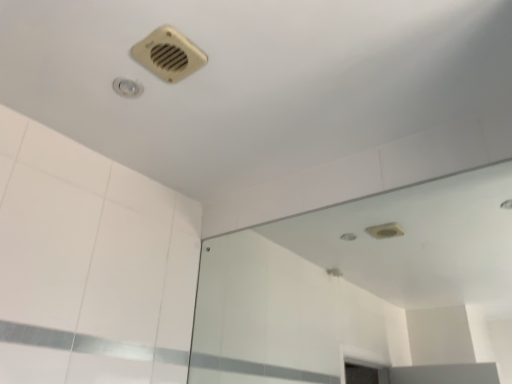
This screenshot has width=512, height=384. What do you see at coordinates (364, 289) in the screenshot?
I see `transparent glass mirror at upper center` at bounding box center [364, 289].

In order to face transparent glass mirror at upper center, should I rotate leftwards or rightwards?

Rotate your view right by about 9.907°.

Where is `transparent glass mirror at upper center`? This screenshot has height=384, width=512. transparent glass mirror at upper center is located at coordinates (364, 289).

Measure the distance between beige plastic air conditioning at upper center and camera.

A distance of 1.01 meters exists between beige plastic air conditioning at upper center and camera.

What do you see at coordinates (169, 54) in the screenshot? I see `beige plastic air conditioning at upper center` at bounding box center [169, 54].

At what (x,y) coordinates should I click in order to perform the action: click on beige plastic air conditioning at upper center. Please return your answer as a coordinate pair (x, y). Image resolution: width=512 pixels, height=384 pixels. Looking at the image, I should click on (169, 54).

I want to click on transparent glass mirror at upper center, so click(364, 289).

Is transparent glass mirror at upper center to the right of beige plastic air conditioning at upper center from the viewer's perspective?

Indeed, transparent glass mirror at upper center is positioned on the right side of beige plastic air conditioning at upper center.

Which object is further away from the camera taking this photo, transparent glass mirror at upper center or beige plastic air conditioning at upper center?

Positioned behind is beige plastic air conditioning at upper center.

Considering the positions of points (349, 332) and (188, 75), is point (349, 332) closer to camera compared to point (188, 75)?

No, it is not.

From the image's perspective, is transparent glass mirror at upper center above or below beige plastic air conditioning at upper center?

transparent glass mirror at upper center is below beige plastic air conditioning at upper center.

From a real-world perspective, which is physically above, transparent glass mirror at upper center or beige plastic air conditioning at upper center?

beige plastic air conditioning at upper center.

Which object is thinner, transparent glass mirror at upper center or beige plastic air conditioning at upper center?

With smaller width is transparent glass mirror at upper center.

Considering the relative sizes of transparent glass mirror at upper center and beige plastic air conditioning at upper center in the image provided, is transparent glass mirror at upper center shorter than beige plastic air conditioning at upper center?

No.

Which of these two, transparent glass mirror at upper center or beige plastic air conditioning at upper center, is smaller?

With smaller size is beige plastic air conditioning at upper center.

Is transparent glass mirror at upper center positioned beyond the bounds of beige plastic air conditioning at upper center?

transparent glass mirror at upper center is positioned outside beige plastic air conditioning at upper center.

Is transparent glass mirror at upper center next to beige plastic air conditioning at upper center?

No, transparent glass mirror at upper center is not next to beige plastic air conditioning at upper center.

Could you tell me if transparent glass mirror at upper center is facing beige plastic air conditioning at upper center?

Yes, transparent glass mirror at upper center is facing beige plastic air conditioning at upper center.

How many degrees apart are the facing directions of transparent glass mirror at upper center and beige plastic air conditioning at upper center?

The angle between the facing direction of transparent glass mirror at upper center and the facing direction of beige plastic air conditioning at upper center is 1.69 degrees.

Measure the distance from transparent glass mirror at upper center to beige plastic air conditioning at upper center.

transparent glass mirror at upper center and beige plastic air conditioning at upper center are 1.54 meters apart.

Locate an element on the screen. The width and height of the screenshot is (512, 384). mirror lying in front of the beige plastic air conditioning at upper center is located at coordinates (364, 289).

Which object is positioned more to the left, beige plastic air conditioning at upper center or transparent glass mirror at upper center?

beige plastic air conditioning at upper center.

Which object is further away from the camera, beige plastic air conditioning at upper center or transparent glass mirror at upper center?

beige plastic air conditioning at upper center is behind.

Does point (145, 48) come behind point (500, 350)?

No, it is in front of (500, 350).

From the image's perspective, is beige plastic air conditioning at upper center under transparent glass mirror at upper center?

No, from the image's perspective, beige plastic air conditioning at upper center is not below transparent glass mirror at upper center.

From a real-world perspective, is beige plastic air conditioning at upper center positioned above or below transparent glass mirror at upper center?

From a real-world perspective, beige plastic air conditioning at upper center is physically above transparent glass mirror at upper center.

Does beige plastic air conditioning at upper center have a greater width compared to transparent glass mirror at upper center?

Yes.

Is beige plastic air conditioning at upper center taller than transparent glass mirror at upper center?

No.

Considering the sizes of objects beige plastic air conditioning at upper center and transparent glass mirror at upper center in the image provided, who is smaller, beige plastic air conditioning at upper center or transparent glass mirror at upper center?

beige plastic air conditioning at upper center is smaller.

Is beige plastic air conditioning at upper center inside or outside of transparent glass mirror at upper center?

beige plastic air conditioning at upper center is outside transparent glass mirror at upper center.

Is beige plastic air conditioning at upper center touching transparent glass mirror at upper center?

There is a gap between beige plastic air conditioning at upper center and transparent glass mirror at upper center.

Based on the photo, is beige plastic air conditioning at upper center turned away from transparent glass mirror at upper center?

beige plastic air conditioning at upper center does not have its back to transparent glass mirror at upper center.

How different are the orientations of beige plastic air conditioning at upper center and transparent glass mirror at upper center in degrees?

The angular difference between beige plastic air conditioning at upper center and transparent glass mirror at upper center is 1.69 degrees.

Where is `air conditioning on the left of transparent glass mirror at upper center`? air conditioning on the left of transparent glass mirror at upper center is located at coordinates (169, 54).

This screenshot has width=512, height=384. Identify the location of mirror that appears below the beige plastic air conditioning at upper center (from the image's perspective). (364, 289).

Identify the location of air conditioning located on the left of transparent glass mirror at upper center. (169, 54).